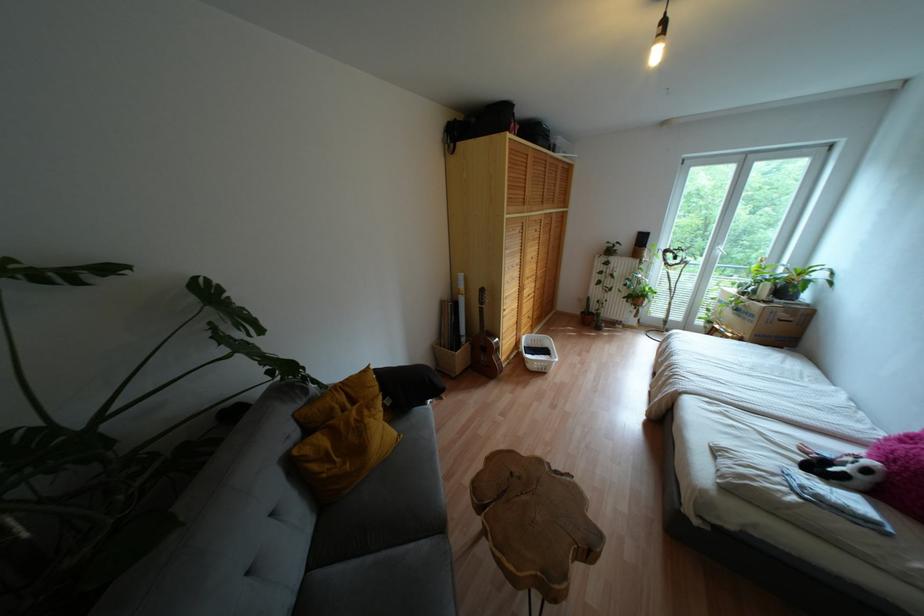
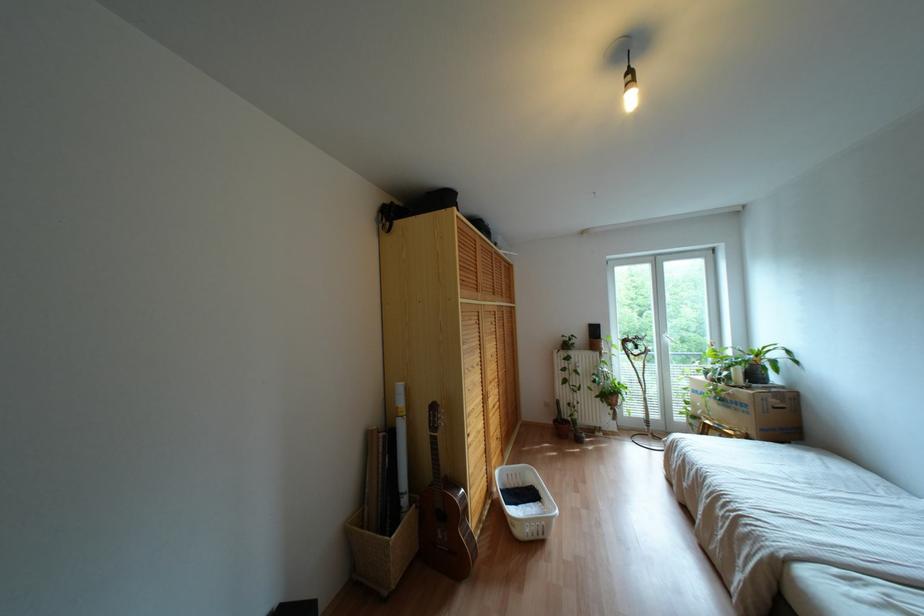
Looking at this image, based on the continuous images, in which direction is the camera rotating?

The camera rotated toward right-up.